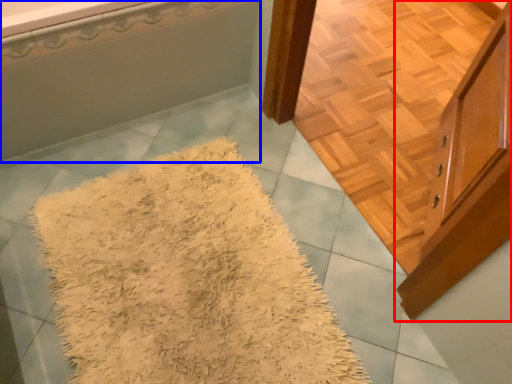
Question: Which object is further to the camera taking this photo, cabinetry (highlighted by a red box) or bathtub (highlighted by a blue box)?

Choices:
 (A) cabinetry
 (B) bathtub

Answer: (B)